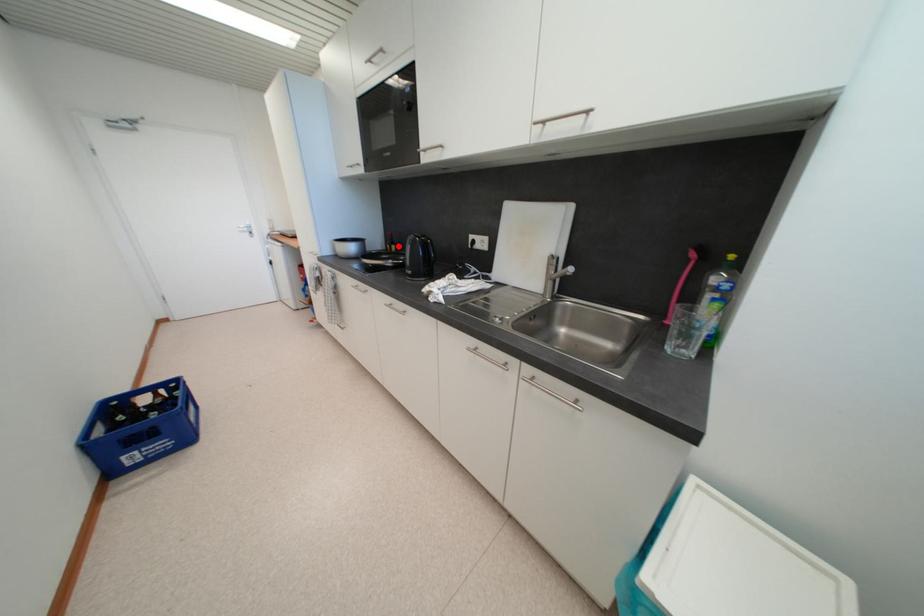
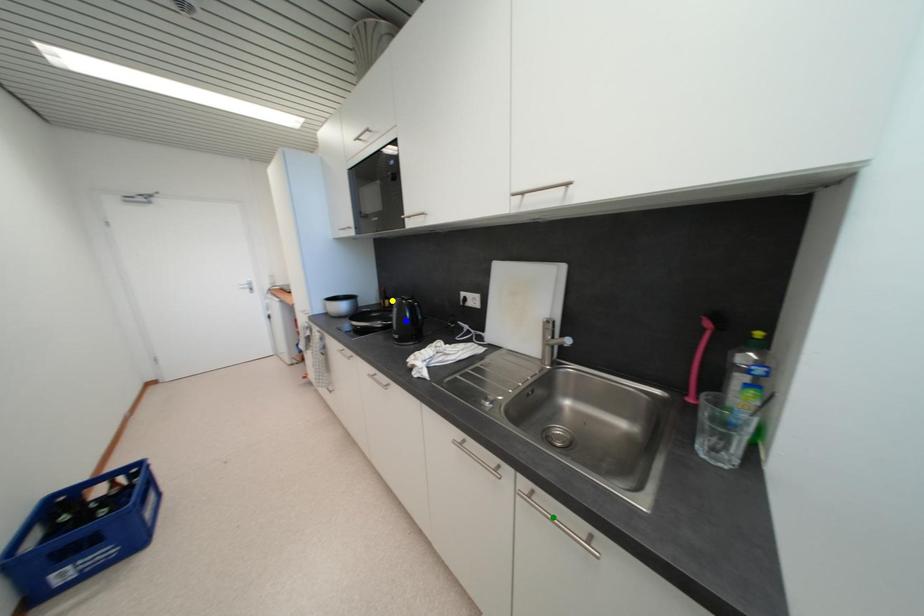
Question: I am providing you with two images of the same scene from different viewpoints. A red point is marked on the first image. You are given multiple points on the second image. In image 2, which mark is for the same physical point as the one in image 1?

Choices:
 (A) yellow point
 (B) green point
 (C) blue point

Answer: (A)